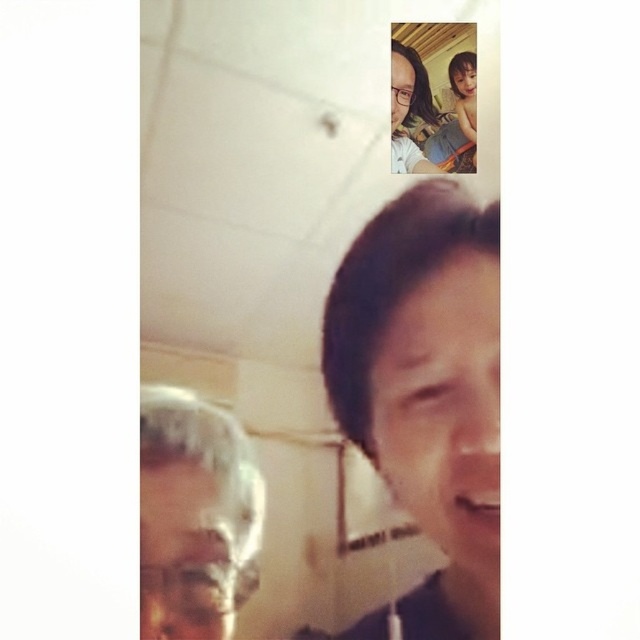
You are a photographer who wants to adjust the focus of your camera to capture both the matte skin face at center and the matte black glasses at upper center clearly. Given their sizes, which object should you focus on first to ensure proper framing?

The matte skin face at center has a greater height compared to the matte black glasses at upper center, so you should focus on the matte skin face at center first to ensure proper framing.

You are taking a photo and want to ensure the matte skin face at center is in focus. Where should you focus your camera?

You should focus your camera at point (444,408) to ensure the matte skin face at center is in focus.